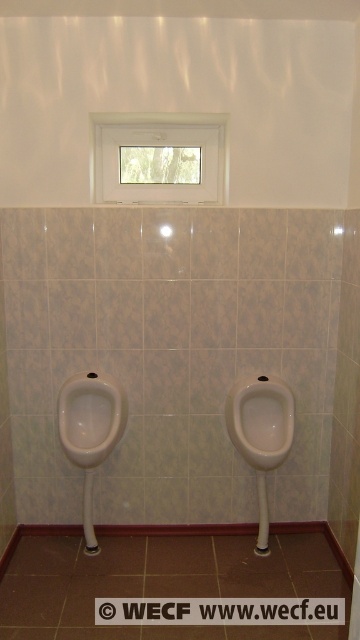
What do you see at coordinates (91, 417) in the screenshot? I see `white glossy urinal at left` at bounding box center [91, 417].

Between point (110, 380) and point (259, 413), which one is positioned in front?

Point (110, 380)

This screenshot has height=640, width=360. I want to click on white glossy urinal at left, so click(x=91, y=417).

You are a GUI agent. You are given a task and a screenshot of the screen. Output one action in this format:
    pyautogui.click(x=<x>, y=<y>)
    Task: Click on the white glossy urinal at left
    This screenshot has height=640, width=360.
    Given the screenshot: What is the action you would take?
    91,417